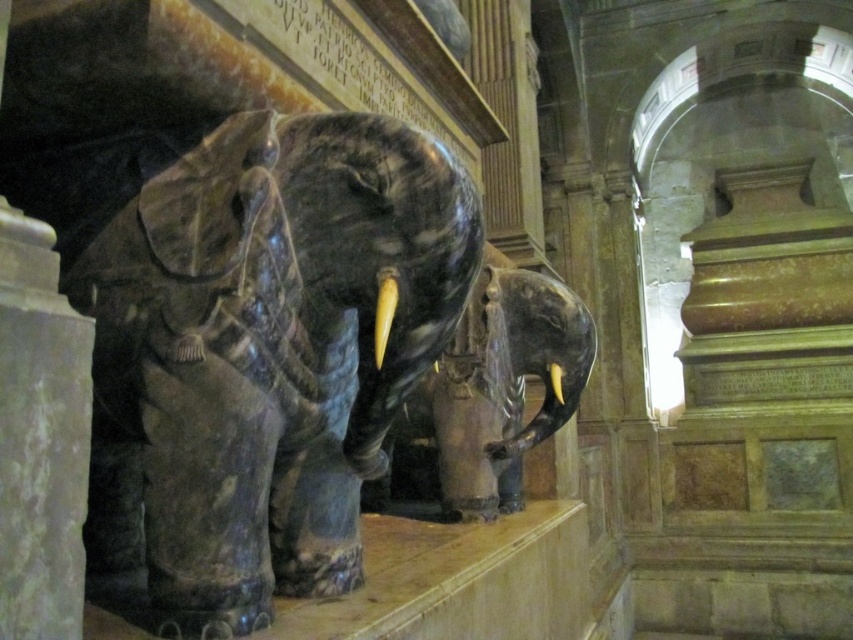
Between polished marble elephant at center and yellow polished tusk at center, which one appears on the right side from the viewer's perspective?

Positioned to the right is yellow polished tusk at center.

Between point (113, 554) and point (550, 372), which one is positioned in front?

Point (113, 554) is more forward.

You are a GUI agent. You are given a task and a screenshot of the screen. Output one action in this format:
    pyautogui.click(x=<x>, y=<y>)
    Task: Click on the polished marble elephant at center
    Image resolution: width=853 pixels, height=640 pixels.
    Given the screenshot: What is the action you would take?
    pyautogui.click(x=260, y=358)

How much distance is there between white marble pillar at left and white glossy tusk at center?

They are 31.46 inches apart.

Is white marble pillar at left further to the viewer compared to white glossy tusk at center?

No.

Identify the location of white marble pillar at left. The image size is (853, 640). (39, 436).

You are a GUI agent. You are given a task and a screenshot of the screen. Output one action in this format:
    pyautogui.click(x=<x>, y=<y>)
    Task: Click on the white marble pillar at left
    This screenshot has width=853, height=640.
    Given the screenshot: What is the action you would take?
    pyautogui.click(x=39, y=436)

Is white marble pillar at left shorter than yellow polished tusk at center?

Incorrect, white marble pillar at left's height does not fall short of yellow polished tusk at center's.

Consider the image. Between white marble pillar at left and yellow polished tusk at center, which one appears on the right side from the viewer's perspective?

yellow polished tusk at center

Consider the image. Who is more distant from viewer, (53, 266) or (561, 401)?

Positioned behind is point (561, 401).

Find the location of `white marble pillar at left`. white marble pillar at left is located at coordinates (39, 436).